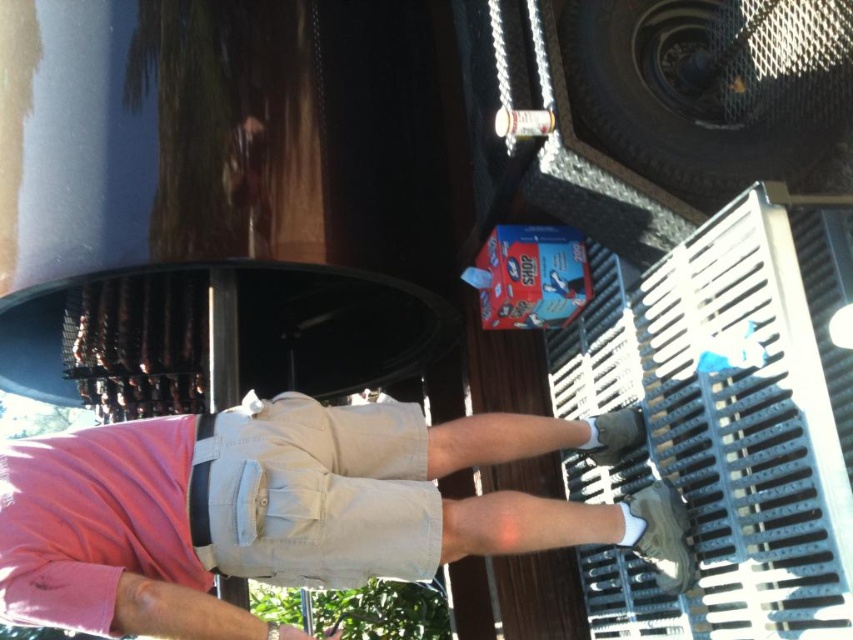
You are a fashion designer observing a model wearing the pink cotton shirt at upper left and khaki cotton shorts at center. Which clothing item is taller?

The pink cotton shirt at upper left is taller than the khaki cotton shorts at center.

You are a fashion designer observing the outfit of a person in the image. Which item of clothing has a larger size between the pink cotton shirt at upper left and the khaki cotton shorts at center?

The pink cotton shirt at upper left has a larger size compared to the khaki cotton shorts at center.

You are a fashion designer analyzing clothing layers in the image. Which clothing item is closer to the viewer between the pink cotton shirt at upper left and the khaki cotton shorts at center?

The pink cotton shirt at upper left is closer to the viewer than the khaki cotton shorts at center because it is positioned in front of it.